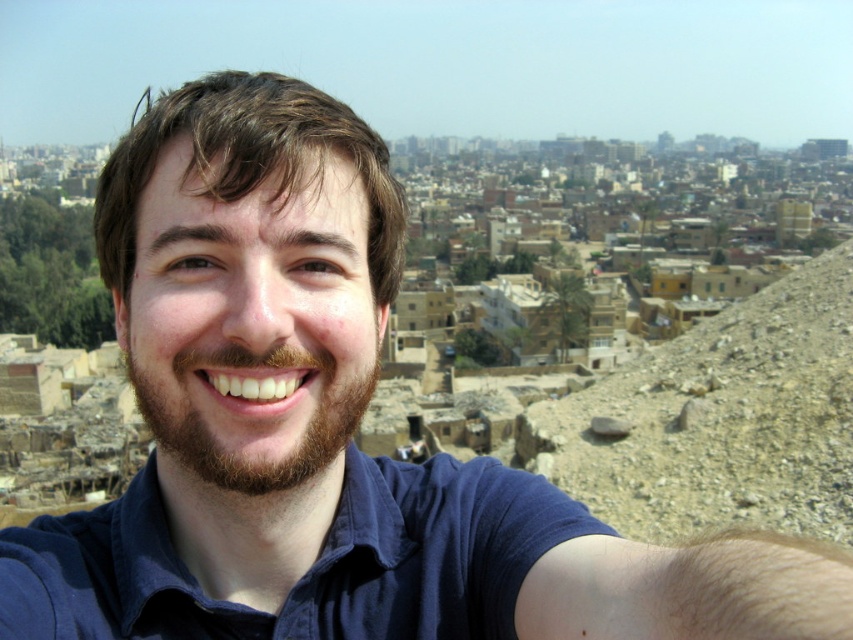
Find the location of a particular element. This screenshot has width=853, height=640. brown rocky hillside at right is located at coordinates (720, 420).

This screenshot has height=640, width=853. Describe the element at coordinates (720, 420) in the screenshot. I see `brown rocky hillside at right` at that location.

Locate an element on the screen. Image resolution: width=853 pixels, height=640 pixels. brown rocky hillside at right is located at coordinates (720, 420).